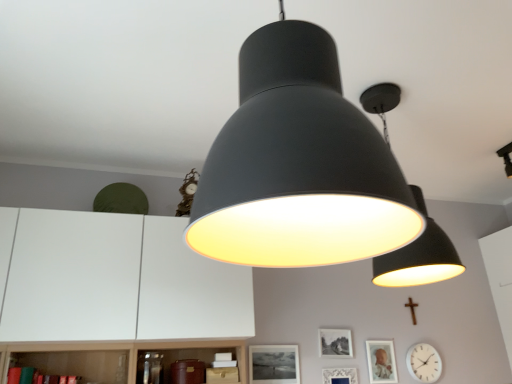
Question: Is matte black lampshade at center, which appears as the 2th lamp when viewed from the back, to the right of matte black lampshade at upper center, which appears as the 2th lamp when viewed from the left, from the viewer's perspective?

Choices:
 (A) yes
 (B) no

Answer: (B)

Question: Is matte black lampshade at center, which ranks as the second lamp in right-to-left order, wider than matte black lampshade at upper center, which appears as the 2th lamp when viewed from the left?

Choices:
 (A) yes
 (B) no

Answer: (A)

Question: Is matte black lampshade at center, which appears as the 2th lamp when viewed from the back, facing away from matte black lampshade at upper center, positioned as the 1th lamp in right-to-left order?

Choices:
 (A) no
 (B) yes

Answer: (A)

Question: From the image's perspective, does matte black lampshade at center, which is counted as the 1th lamp, starting from the left, appear lower than matte black lampshade at upper center, the 2th lamp viewed from the front?

Choices:
 (A) yes
 (B) no

Answer: (B)

Question: Does matte black lampshade at center, which appears as the 2th lamp when viewed from the back, turn towards matte black lampshade at upper center, positioned as the 1th lamp in right-to-left order?

Choices:
 (A) no
 (B) yes

Answer: (A)

Question: Does matte black lampshade at center, which ranks as the second lamp in right-to-left order, lie in front of matte black lampshade at upper center, the 2th lamp viewed from the front?

Choices:
 (A) no
 (B) yes

Answer: (B)

Question: Is white glossy clock at lower right at the back of black matte picture frame at center, which ranks as the 1th picture frame in left-to-right order?

Choices:
 (A) yes
 (B) no

Answer: (B)

Question: From a real-world perspective, is black matte picture frame at center, which ranks as the 1th picture frame in left-to-right order, positioned under white glossy clock at lower right based on gravity?

Choices:
 (A) no
 (B) yes

Answer: (A)

Question: Considering the relative positions of black matte picture frame at center, which is the 4th picture frame from right to left, and white glossy clock at lower right in the image provided, is black matte picture frame at center, which is the 4th picture frame from right to left, in front of white glossy clock at lower right?

Choices:
 (A) yes
 (B) no

Answer: (A)

Question: Is black matte picture frame at center, which is the 4th picture frame from right to left, aimed at white glossy clock at lower right?

Choices:
 (A) no
 (B) yes

Answer: (A)

Question: Is black matte picture frame at center, which ranks as the 1th picture frame in left-to-right order, to the left of white glossy clock at lower right from the viewer's perspective?

Choices:
 (A) yes
 (B) no

Answer: (A)

Question: From the image's perspective, is black matte picture frame at center, which is the 4th picture frame from right to left, under white glossy clock at lower right?

Choices:
 (A) yes
 (B) no

Answer: (B)

Question: Does matte black lampshade at center, which appears as the 2th lamp when viewed from the back, contain wooden cross at lower right?

Choices:
 (A) yes
 (B) no

Answer: (B)